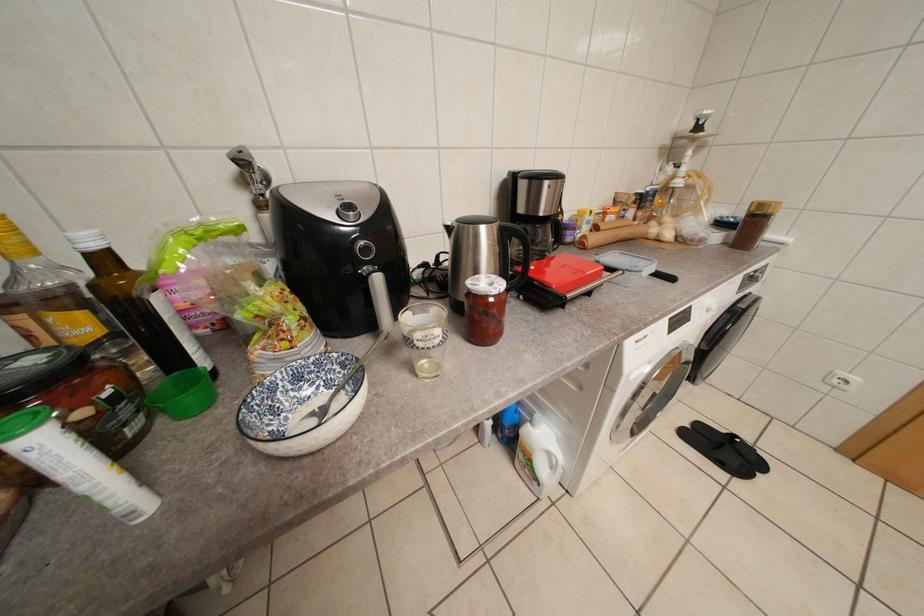
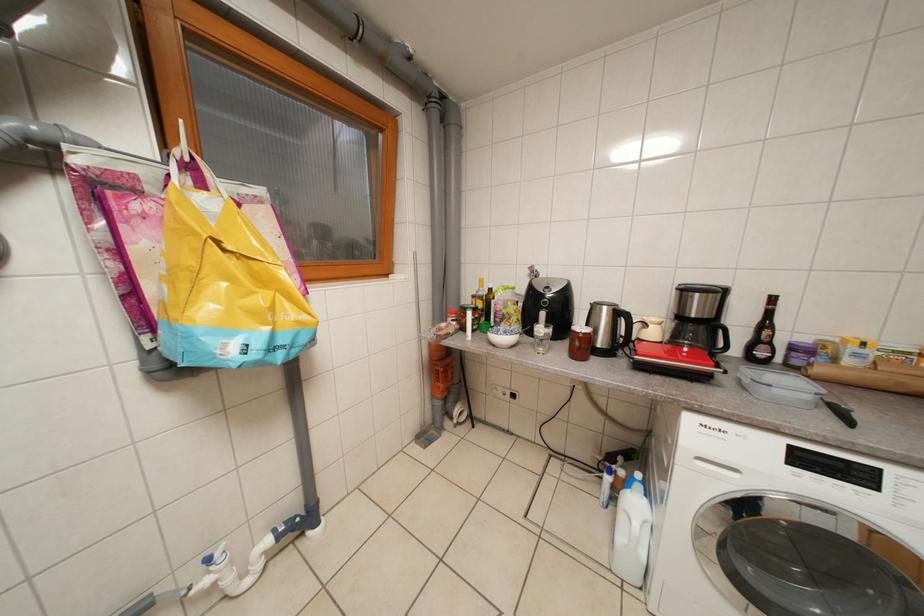
Question: Based on the continuous images, in which direction is the camera rotating? Reply with the corresponding letter.

Choices:
 (A) Left
 (B) Right
 (C) Up
 (D) Down

Answer: (A)